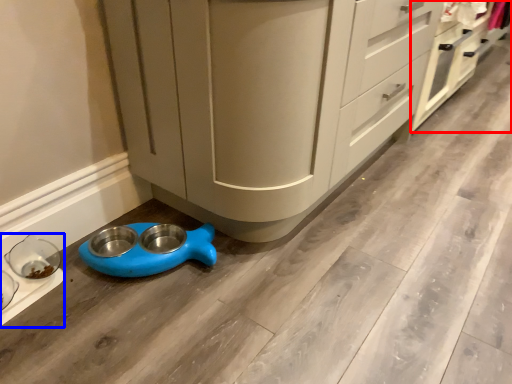
Question: Which of the following is the closest to the observer, cabinetry (highlighted by a red box) or appliance (highlighted by a blue box)?

Choices:
 (A) cabinetry
 (B) appliance

Answer: (B)